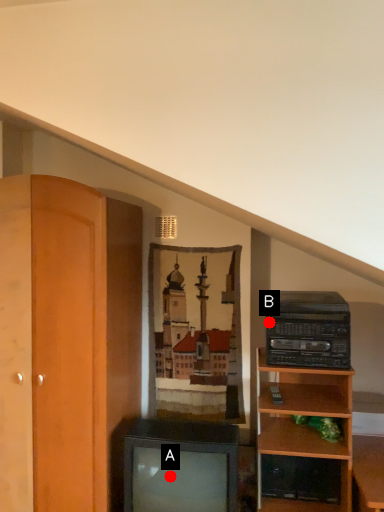
Question: Two points are circled on the image, labeled by A and B beside each circle. Which point is further to the camera?

Choices:
 (A) A is further
 (B) B is further

Answer: (B)